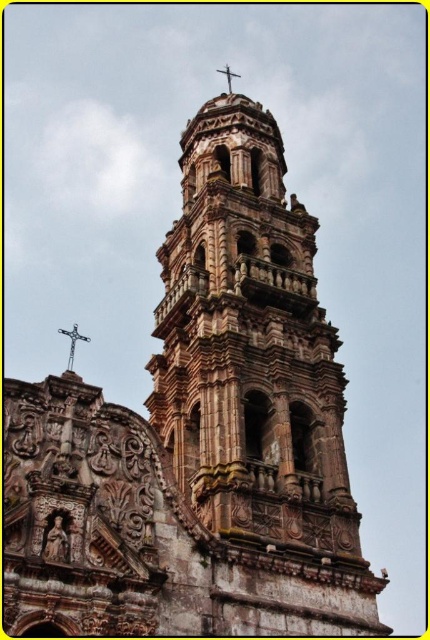
Question: Considering the relative positions of silver metallic cross at upper center and metallic cross at top-center in the image provided, where is silver metallic cross at upper center located with respect to metallic cross at top-center?

Choices:
 (A) above
 (B) below

Answer: (B)

Question: Does silver metallic cross at upper center appear over metallic cross at top-center?

Choices:
 (A) yes
 (B) no

Answer: (B)

Question: Which point is closer to the camera?

Choices:
 (A) stone carved tower at center
 (B) silver metallic cross at upper center

Answer: (A)

Question: Is silver metallic cross at upper center smaller than metallic cross at top-center?

Choices:
 (A) yes
 (B) no

Answer: (B)

Question: Which is nearer to the stone carved tower at center?

Choices:
 (A) silver metallic cross at upper center
 (B) metallic cross at top-center

Answer: (A)

Question: Which object appears farthest from the camera in this image?

Choices:
 (A) silver metallic cross at upper center
 (B) stone carved tower at center

Answer: (A)